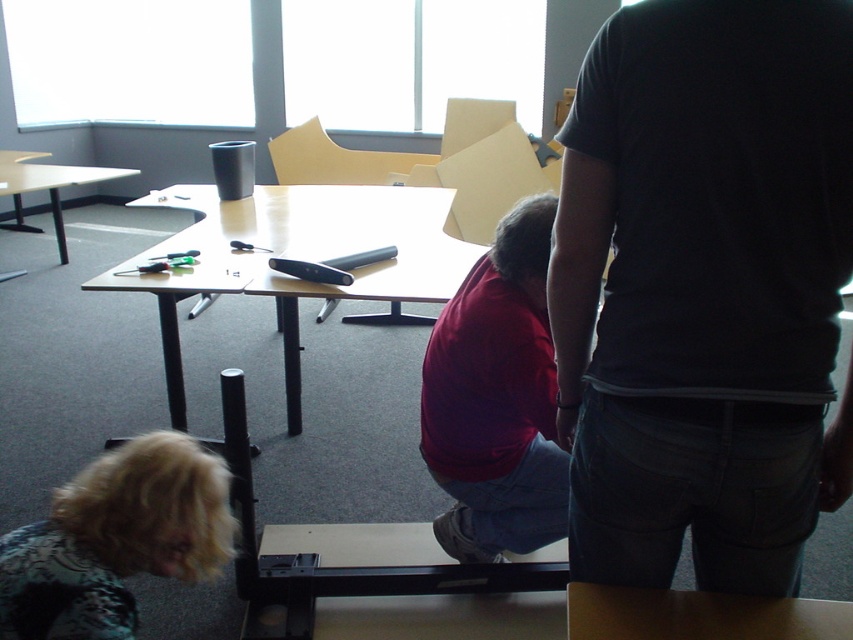
In order to click on dark gray t-shirt at center in this screenshot , I will do `click(705, 289)`.

Which is below, dark gray t-shirt at center or brown wooden table at lower center?

brown wooden table at lower center is lower down.

Is point (582, 113) positioned in front of point (595, 589)?

That is True.

Locate an element on the screen. dark gray t-shirt at center is located at coordinates (705, 289).

Measure the distance between point (640, 24) and camera.

Point (640, 24) is 37.69 inches away from camera.

The image size is (853, 640). Find the location of `dark gray t-shirt at center`. dark gray t-shirt at center is located at coordinates (705, 289).

Based on the photo, is the position of brown wooden table at lower center less distant than that of matte black table at left?

Yes.

I want to click on brown wooden table at lower center, so click(699, 616).